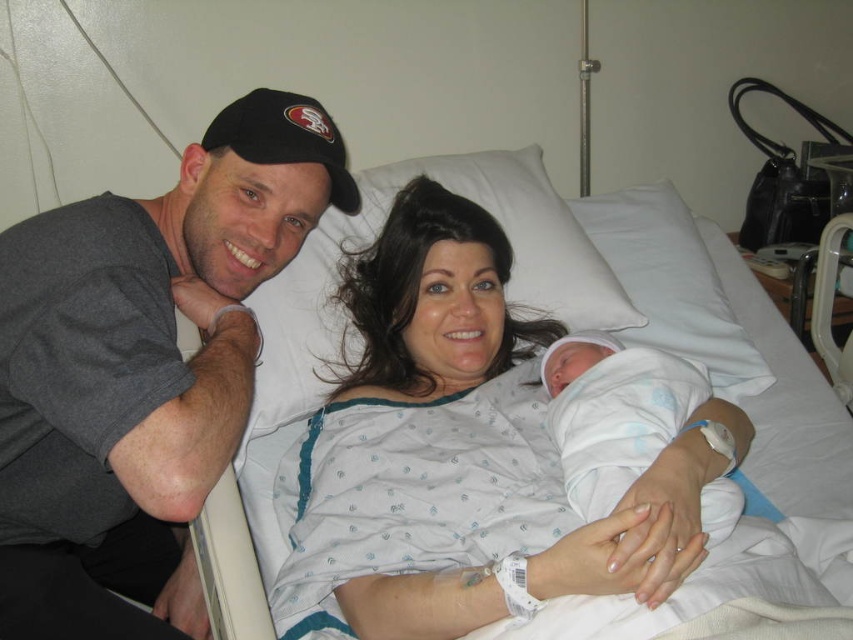
Question: Which point is farther to the camera?

Choices:
 (A) (109, 211)
 (B) (657, 451)
 (C) (345, 509)

Answer: (A)

Question: Based on their relative distances, which object is farther from the white cotton hospital gown at center?

Choices:
 (A) white soft swaddled newborn at center
 (B) gray cotton t-shirt at upper left

Answer: (B)

Question: Can you confirm if gray cotton t-shirt at upper left is positioned to the right of white soft swaddled newborn at center?

Choices:
 (A) no
 (B) yes

Answer: (A)

Question: Does white cotton hospital gown at center have a larger size compared to white soft swaddled newborn at center?

Choices:
 (A) no
 (B) yes

Answer: (B)

Question: In this image, where is gray cotton t-shirt at upper left located relative to white soft swaddled newborn at center?

Choices:
 (A) below
 (B) above

Answer: (B)

Question: Which of the following is the farthest from the observer?

Choices:
 (A) (448, 628)
 (B) (35, 586)
 (C) (669, 358)

Answer: (C)